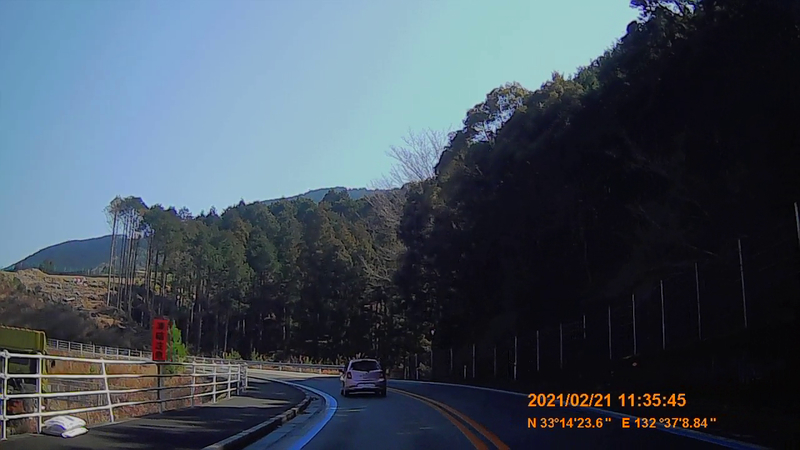
The image size is (800, 450). I want to click on horizontal railing, so click(122, 361), click(122, 373), click(134, 392), click(137, 404).